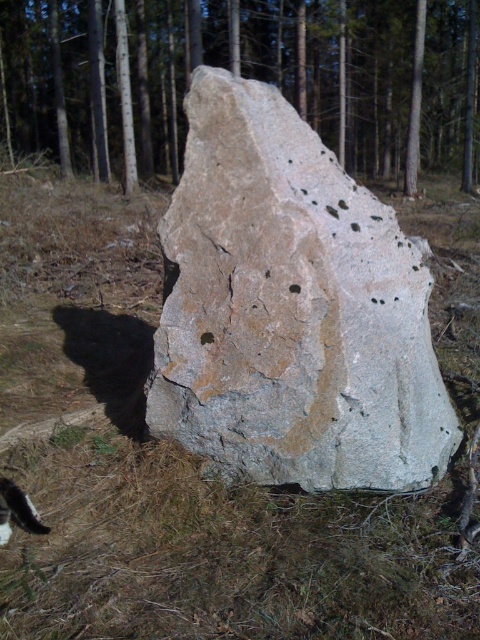
Question: Is speckled stone at center bigger than brown rough rock at center?

Choices:
 (A) yes
 (B) no

Answer: (B)

Question: Which point appears farthest from the camera in this image?

Choices:
 (A) (0, 531)
 (B) (249, 157)

Answer: (B)

Question: Among these points, which one is farthest from the camera?

Choices:
 (A) (247, 67)
 (B) (300, 184)
 (C) (31, 524)

Answer: (A)

Question: Which point is farther to the camera?

Choices:
 (A) (178, 387)
 (B) (214, 26)
 (C) (19, 516)

Answer: (B)

Question: Does speckled stone at center have a smaller size compared to brown rough rock at center?

Choices:
 (A) no
 (B) yes

Answer: (B)

Question: Where is speckled stone at center located in relation to brown rough rock at center in the image?

Choices:
 (A) right
 (B) left

Answer: (B)